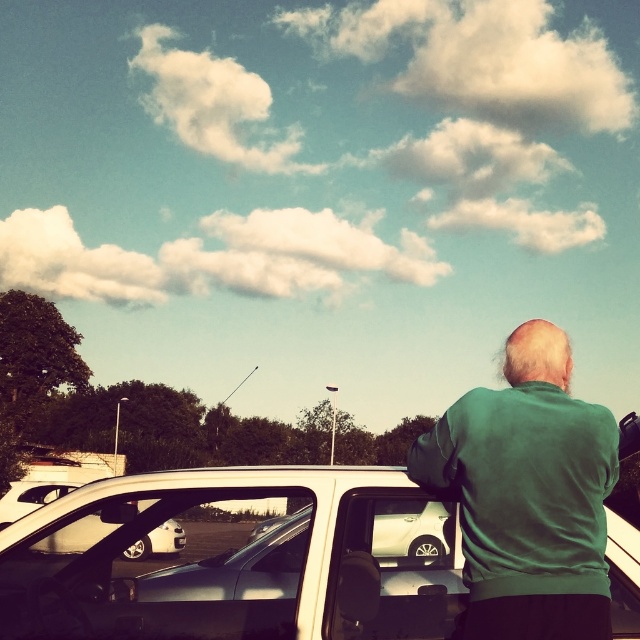
You are a delivery drone trying to navigate to the white matte car at center. What are the coordinates you should fly to?

The coordinates for the white matte car at center are at point (236,557).

You are a photographer trying to capture a photo of the white matte car at center and the green matte jacket at upper right. Which object should you focus on first if you want to ensure both are in sharp focus, considering their sizes in the frame?

The white matte car at center is not as tall as the green matte jacket at upper right, so the photographer should focus on the green matte jacket at upper right first since it is larger in the frame and requires more precise focus to ensure both objects are sharp.